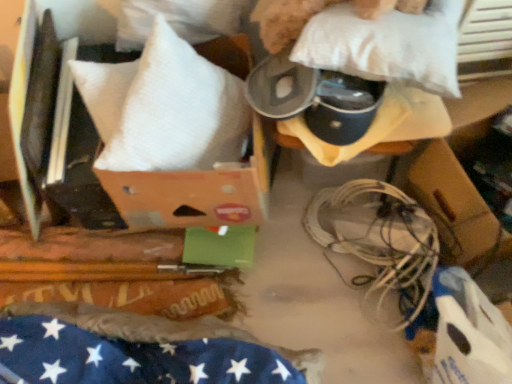
The image size is (512, 384). What do you see at coordinates (172, 109) in the screenshot? I see `white soft pillow at upper left, the first pillow positioned from the left` at bounding box center [172, 109].

Where is `white soft pillow at upper center, which is the 2th pillow from left to right`? The height and width of the screenshot is (384, 512). white soft pillow at upper center, which is the 2th pillow from left to right is located at coordinates (386, 45).

How many degrees apart are the facing directions of white soft pillow at upper left, the 2th pillow in the right-to-left sequence, and white matte wires at lower right?

They differ by 2.07 degrees in their facing directions.

Can you confirm if white soft pillow at upper left, the first pillow positioned from the left, is shorter than white matte wires at lower right?

In fact, white soft pillow at upper left, the first pillow positioned from the left, may be taller than white matte wires at lower right.

Is point (129, 113) positioned behind point (388, 229)?

No.

Which object is positioned more to the left, white soft pillow at upper center, which is the 2th pillow from left to right, or white soft pillow at upper left, the 2th pillow in the right-to-left sequence?

From the viewer's perspective, white soft pillow at upper left, the 2th pillow in the right-to-left sequence, appears more on the left side.

From a real-world perspective, which is physically above, white soft pillow at upper center, which is the 2th pillow from left to right, or white soft pillow at upper left, the first pillow positioned from the left?

white soft pillow at upper center, which is the 2th pillow from left to right.

Based on their sizes in the image, would you say white soft pillow at upper center, arranged as the first pillow when viewed from the right, is bigger or smaller than white soft pillow at upper left, the 2th pillow in the right-to-left sequence?

In the image, white soft pillow at upper center, arranged as the first pillow when viewed from the right, appears to be smaller than white soft pillow at upper left, the 2th pillow in the right-to-left sequence.

Can you confirm if white soft pillow at upper center, which is the 2th pillow from left to right, is taller than white soft pillow at upper left, the 2th pillow in the right-to-left sequence?

Incorrect, the height of white soft pillow at upper center, which is the 2th pillow from left to right, is not larger of that of white soft pillow at upper left, the 2th pillow in the right-to-left sequence.

Does point (105, 156) come in front of point (428, 18)?

That is False.

Is white soft pillow at upper left, the 2th pillow in the right-to-left sequence, not near white soft pillow at upper center, which is the 2th pillow from left to right?

white soft pillow at upper left, the 2th pillow in the right-to-left sequence, is near white soft pillow at upper center, which is the 2th pillow from left to right, not far away.

Is white soft pillow at upper center, which is the 2th pillow from left to right, at the back of white soft pillow at upper left, the first pillow positioned from the left?

No, white soft pillow at upper left, the first pillow positioned from the left, is not facing away from white soft pillow at upper center, which is the 2th pillow from left to right.

Can you confirm if white soft pillow at upper center, which is the 2th pillow from left to right, is shorter than white matte wires at lower right?

Correct, white soft pillow at upper center, which is the 2th pillow from left to right, is not as tall as white matte wires at lower right.

Is white soft pillow at upper center, which is the 2th pillow from left to right, located outside white matte wires at lower right?

Absolutely, white soft pillow at upper center, which is the 2th pillow from left to right, is external to white matte wires at lower right.

Based on the photo, which point is more forward, (393, 53) or (409, 323)?

The point (393, 53) is closer to the camera.

Could you tell me if white matte wires at lower right is facing white soft pillow at upper left, the first pillow positioned from the left?

No.

Considering the positions of objects white matte wires at lower right and white soft pillow at upper left, the first pillow positioned from the left, in the image provided, who is more to the left, white matte wires at lower right or white soft pillow at upper left, the first pillow positioned from the left,?

white soft pillow at upper left, the first pillow positioned from the left, is more to the left.

Can you tell me how much white matte wires at lower right and white soft pillow at upper left, the 2th pillow in the right-to-left sequence, differ in facing direction?

white matte wires at lower right and white soft pillow at upper left, the 2th pillow in the right-to-left sequence, are facing 2.07 degrees away from each other.

Considering the relative sizes of white matte wires at lower right and white soft pillow at upper left, the first pillow positioned from the left, in the image provided, is white matte wires at lower right wider than white soft pillow at upper left, the first pillow positioned from the left,?

No, white matte wires at lower right is not wider than white soft pillow at upper left, the first pillow positioned from the left.

Is white matte wires at lower right next to white soft pillow at upper center, which is the 2th pillow from left to right, and touching it?

No, white matte wires at lower right is not touching white soft pillow at upper center, which is the 2th pillow from left to right.

Is white matte wires at lower right to the left or to the right of white soft pillow at upper center, arranged as the first pillow when viewed from the right, in the image?

Clearly, white matte wires at lower right is on the right of white soft pillow at upper center, arranged as the first pillow when viewed from the right, in the image.

Considering the relative sizes of white matte wires at lower right and white soft pillow at upper center, which is the 2th pillow from left to right, in the image provided, is white matte wires at lower right thinner than white soft pillow at upper center, which is the 2th pillow from left to right,?

No.

Locate an element on the screen. The image size is (512, 384). wire on the right side of white soft pillow at upper left, the first pillow positioned from the left is located at coordinates (378, 243).

The width and height of the screenshot is (512, 384). Find the location of `pillow located on the left of white soft pillow at upper center, arranged as the first pillow when viewed from the right`. pillow located on the left of white soft pillow at upper center, arranged as the first pillow when viewed from the right is located at coordinates point(172,109).

Considering their positions, is white matte wires at lower right positioned further to white soft pillow at upper left, the 2th pillow in the right-to-left sequence, than white soft pillow at upper center, arranged as the first pillow when viewed from the right?

white matte wires at lower right.

Looking at the image, which one is located further to white soft pillow at upper center, arranged as the first pillow when viewed from the right, white soft pillow at upper left, the first pillow positioned from the left, or white matte wires at lower right?

white matte wires at lower right lies further to white soft pillow at upper center, arranged as the first pillow when viewed from the right, than the other object.

Considering their positions, is white soft pillow at upper center, arranged as the first pillow when viewed from the right, positioned closer to white matte wires at lower right than white soft pillow at upper left, the 2th pillow in the right-to-left sequence?

Among the two, white soft pillow at upper center, arranged as the first pillow when viewed from the right, is located nearer to white matte wires at lower right.

Based on their spatial positions, is white soft pillow at upper center, arranged as the first pillow when viewed from the right, or white matte wires at lower right further from white soft pillow at upper left, the 2th pillow in the right-to-left sequence?

Among the two, white matte wires at lower right is located further to white soft pillow at upper left, the 2th pillow in the right-to-left sequence.

From the image, which object appears to be farther from white soft pillow at upper center, arranged as the first pillow when viewed from the right, white matte wires at lower right or white soft pillow at upper left, the 2th pillow in the right-to-left sequence?

white matte wires at lower right lies further to white soft pillow at upper center, arranged as the first pillow when viewed from the right, than the other object.

Based on their spatial positions, is white soft pillow at upper left, the first pillow positioned from the left, or white soft pillow at upper center, which is the 2th pillow from left to right, closer to white matte wires at lower right?

white soft pillow at upper center, which is the 2th pillow from left to right, lies closer to white matte wires at lower right than the other object.

Locate an element on the screen. This screenshot has height=384, width=512. pillow that lies between white soft pillow at upper center, which is the 2th pillow from left to right, and white matte wires at lower right from top to bottom is located at coordinates (172, 109).